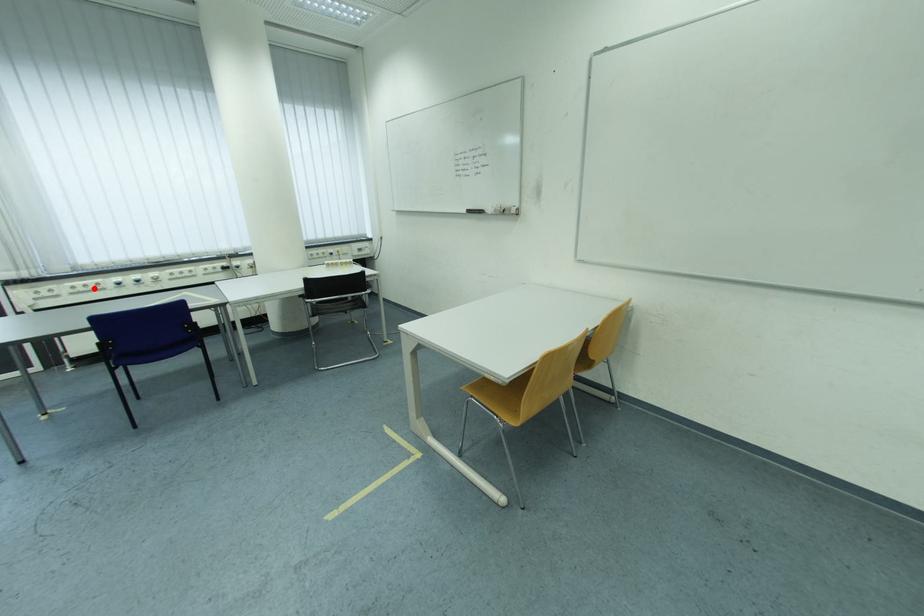
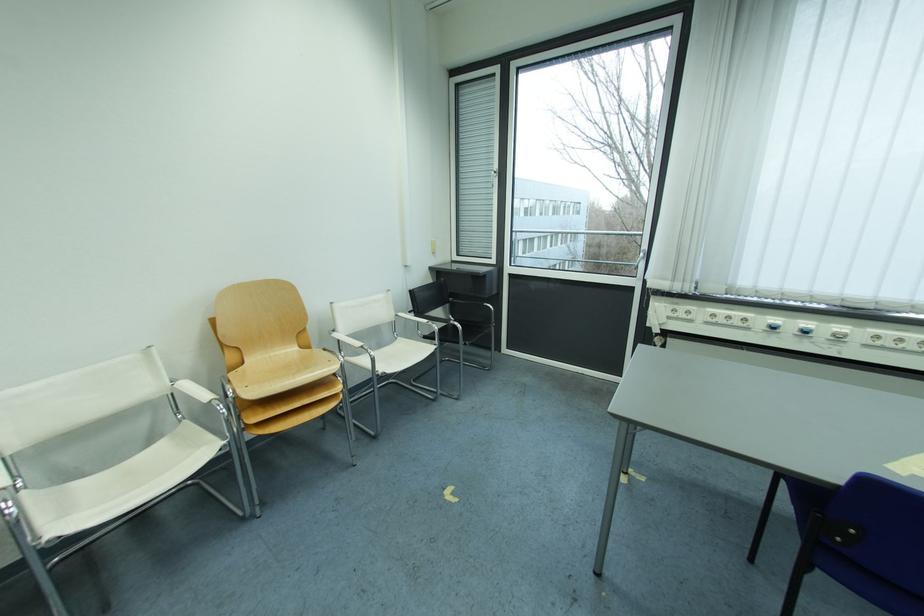
The point at the highlighted location is marked in the first image. Where is the corresponding point in the second image?

(737, 320)